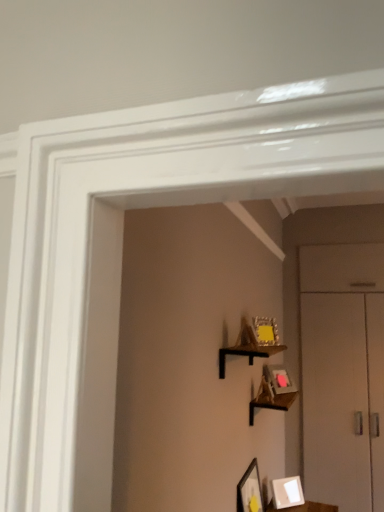
Question: Can you confirm if matte gold picture frame at upper center, the 4th picture frame when ordered from bottom to top, is thinner than wooden shelf at upper center, which is the 2th shelf in back-to-front order?

Choices:
 (A) yes
 (B) no

Answer: (A)

Question: Does matte gold picture frame at upper center, the 4th picture frame when ordered from bottom to top, appear on the right side of wooden shelf at upper center, which is the 2th shelf in back-to-front order?

Choices:
 (A) no
 (B) yes

Answer: (B)

Question: From a real-world perspective, is matte gold picture frame at upper center, the 4th picture frame when ordered from bottom to top, beneath wooden shelf at upper center, which is the 2th shelf in back-to-front order?

Choices:
 (A) yes
 (B) no

Answer: (B)

Question: Is matte gold picture frame at upper center, arranged as the 2th picture frame when viewed from the top, outside of wooden shelf at upper center, which is the 2th shelf in back-to-front order?

Choices:
 (A) yes
 (B) no

Answer: (A)

Question: Is matte gold picture frame at upper center, the 4th picture frame when ordered from bottom to top, positioned with its back to wooden shelf at upper center, which is the 2th shelf in back-to-front order?

Choices:
 (A) yes
 (B) no

Answer: (B)

Question: From a real-world perspective, is matte gold picture frame at upper right, which is the third picture frame from top to bottom, physically located above or below wooden shelf at upper center, the 1th shelf positioned from the front?

Choices:
 (A) above
 (B) below

Answer: (B)

Question: Relative to wooden shelf at upper center, the 1th shelf positioned from the front, is matte gold picture frame at upper right, which is the third picture frame from top to bottom, in front or behind?

Choices:
 (A) behind
 (B) front

Answer: (A)

Question: Would you say matte gold picture frame at upper right, which is counted as the third picture frame, starting from the bottom, is to the left or to the right of wooden shelf at upper center, which is the second shelf from bottom to top, in the picture?

Choices:
 (A) right
 (B) left

Answer: (A)

Question: Which is correct: matte gold picture frame at upper right, which is the third picture frame from top to bottom, is inside wooden shelf at upper center, which is the 2th shelf in back-to-front order, or outside of it?

Choices:
 (A) outside
 (B) inside

Answer: (A)

Question: From the image's perspective, is matte gold picture frame at upper center, the 4th picture frame when ordered from bottom to top, positioned above or below white matte picture frame at lower center, which is the first picture frame in bottom-to-top order?

Choices:
 (A) below
 (B) above

Answer: (B)

Question: Would you say matte gold picture frame at upper center, arranged as the 2th picture frame when viewed from the top, is inside or outside white matte picture frame at lower center, marked as the 5th picture frame in a top-to-bottom arrangement?

Choices:
 (A) inside
 (B) outside

Answer: (B)

Question: Is point (258, 330) closer or farther from the camera than point (288, 501)?

Choices:
 (A) closer
 (B) farther

Answer: (A)

Question: Is matte gold picture frame at upper center, arranged as the 2th picture frame when viewed from the top, taller or shorter than white matte picture frame at lower center, marked as the 5th picture frame in a top-to-bottom arrangement?

Choices:
 (A) short
 (B) tall

Answer: (B)

Question: Is matte black picture frame at lower center, placed as the 4th picture frame when sorted from top to bottom, bigger or smaller than wooden picture frame at center, the 5th picture frame ordered from the bottom?

Choices:
 (A) big
 (B) small

Answer: (A)

Question: From the image's perspective, relative to wooden picture frame at center, the 1th picture frame when ordered from top to bottom, is matte black picture frame at lower center, the 2th picture frame from the bottom, above or below?

Choices:
 (A) below
 (B) above

Answer: (A)